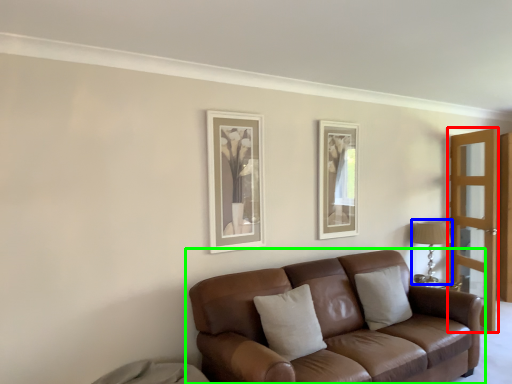
Question: Which is farther away from screen door (highlighted by a red box)? table lamp (highlighted by a blue box) or studio couch (highlighted by a green box)?

Choices:
 (A) table lamp
 (B) studio couch

Answer: (B)